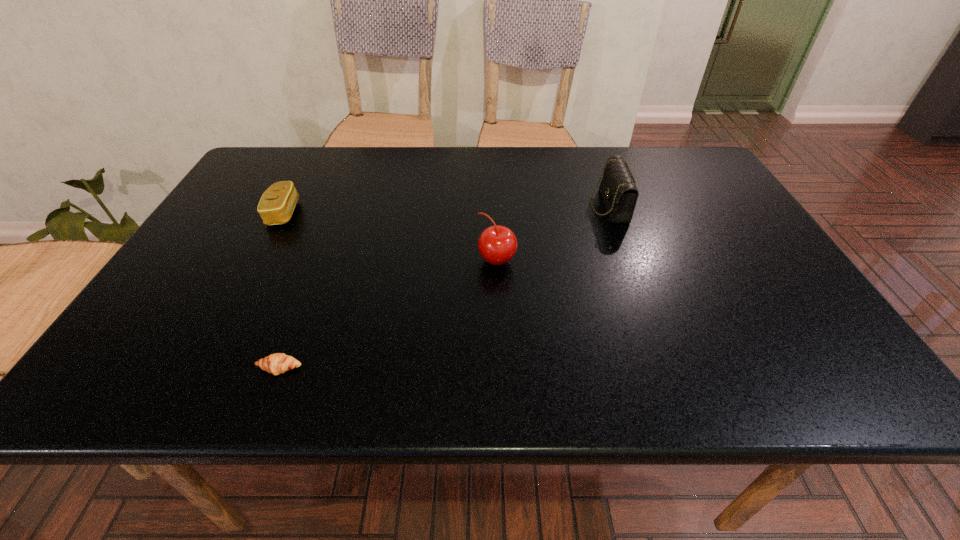
Identify the location of vacant space situated 0.250m on the front flap of the rightmost object. This screenshot has height=540, width=960. (498, 206).

Image resolution: width=960 pixels, height=540 pixels. I want to click on vacant space located 0.220m on the front flap of the rightmost object, so click(509, 206).

Locate an element on the screen. This screenshot has width=960, height=540. free space located 0.150m on the zipper side of the third tallest object is located at coordinates (355, 213).

At what (x,y) coordinates should I click in order to perform the action: click on object that is positioned at the near edge. Please return your answer as a coordinate pair (x, y). The width and height of the screenshot is (960, 540). Looking at the image, I should click on (278, 363).

Where is `object that is at the left edge`? Image resolution: width=960 pixels, height=540 pixels. object that is at the left edge is located at coordinates (277, 203).

What are the coordinates of `vacant point at the far edge` in the screenshot? It's located at (528, 165).

Locate an element on the screen. free space at the near edge of the desktop is located at coordinates (665, 356).

Locate an element on the screen. The width and height of the screenshot is (960, 540). vacant space at the right edge is located at coordinates (688, 200).

Where is `free space at the near left corner of the desktop`? free space at the near left corner of the desktop is located at coordinates (162, 369).

At what (x,y) coordinates should I click in order to perform the action: click on vacant position at the far right corner of the desktop. Please return your answer as a coordinate pair (x, y). Looking at the image, I should click on (673, 180).